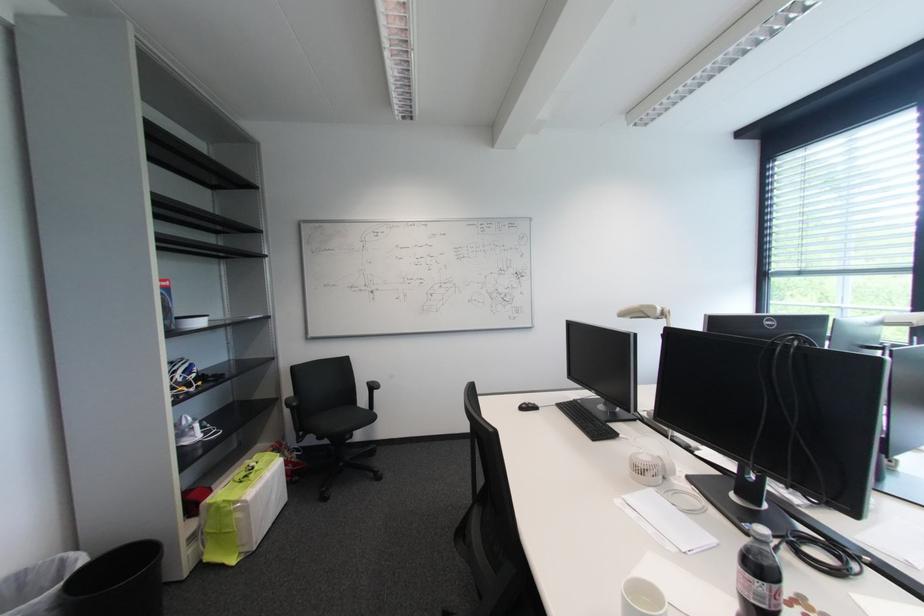
I want to click on chair sitting surface, so click(337, 421).